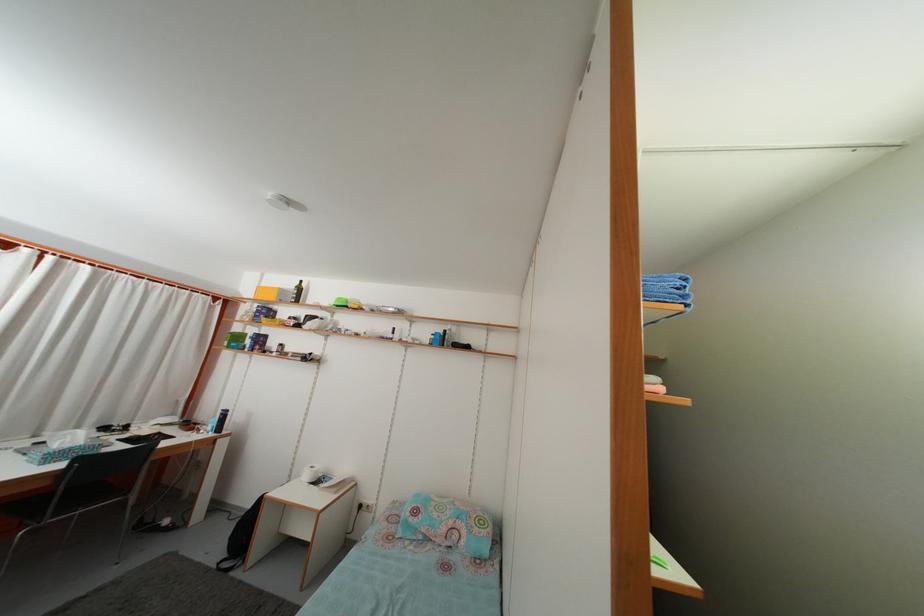
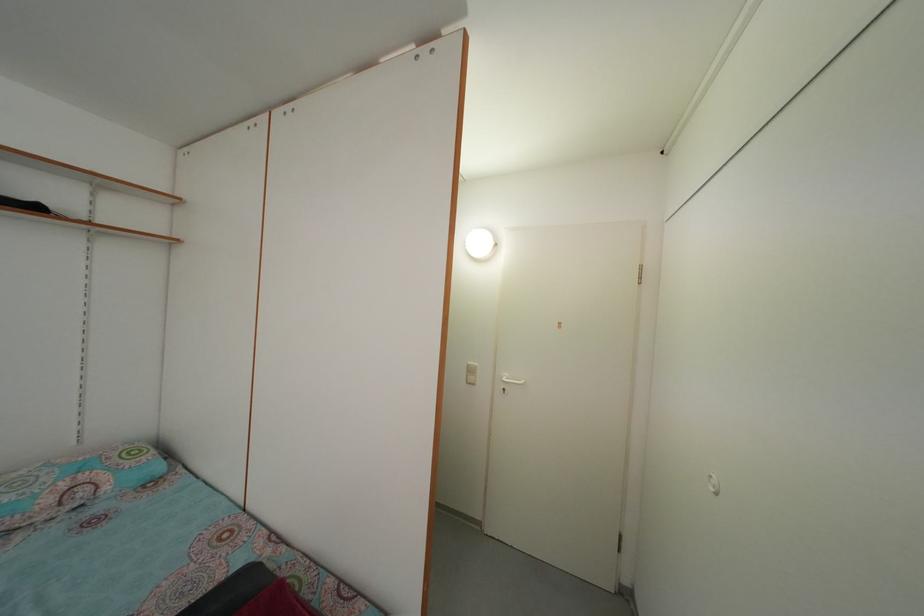
Question: The camera is either moving clockwise (left) or counter-clockwise (right) around the object. The first image is from the beginning of the video and the second image is from the end. Is the camera moving left or right when shooting the video?

Choices:
 (A) Left
 (B) Right

Answer: (A)